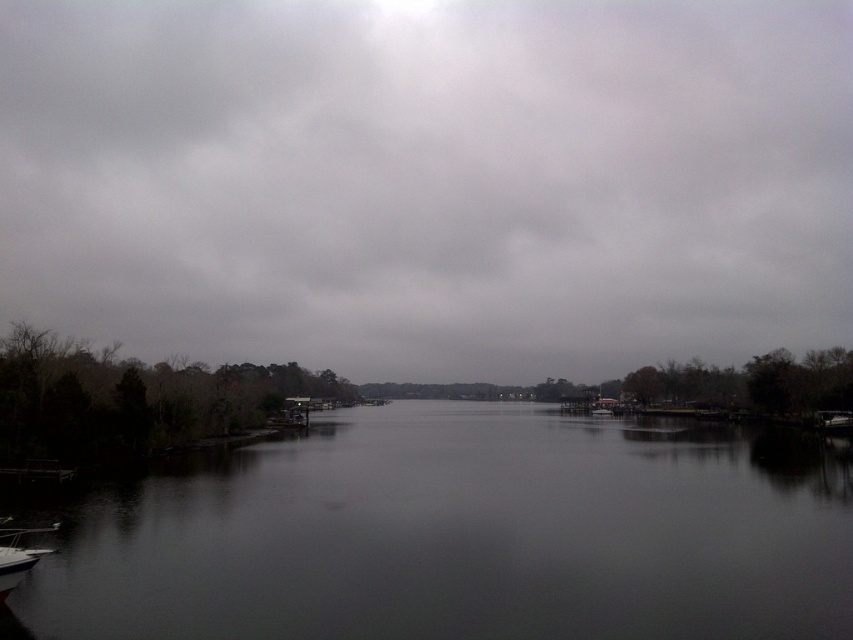
Question: Which point appears farthest from the camera in this image?

Choices:
 (A) (622, 257)
 (B) (387, 609)
 (C) (7, 547)

Answer: (A)

Question: Is gray cloudy sky at upper center wider than white glossy boat at lower left?

Choices:
 (A) yes
 (B) no

Answer: (A)

Question: Does gray cloudy sky at upper center appear on the right side of dark water at center?

Choices:
 (A) no
 (B) yes

Answer: (A)

Question: Does gray cloudy sky at upper center lie behind dark water at center?

Choices:
 (A) no
 (B) yes

Answer: (B)

Question: Which of the following is the closest to the observer?

Choices:
 (A) gray cloudy sky at upper center
 (B) white glossy boat at lower left
 (C) dark water at center

Answer: (C)

Question: Which point is closer to the camera?

Choices:
 (A) (38, 548)
 (B) (445, 244)

Answer: (A)